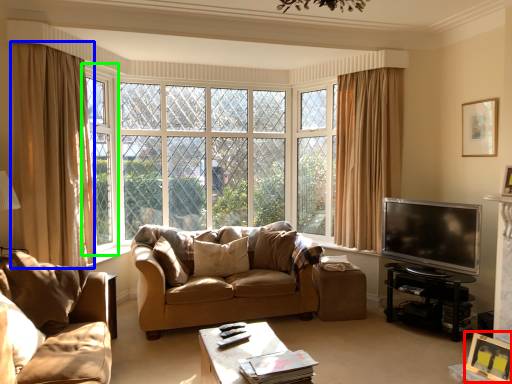
Question: Based on their relative distances, which object is nearer to picture frame (highlighted by a red box)? Choose from curtain (highlighted by a blue box) and window frame (highlighted by a green box).

Choices:
 (A) curtain
 (B) window frame

Answer: (A)